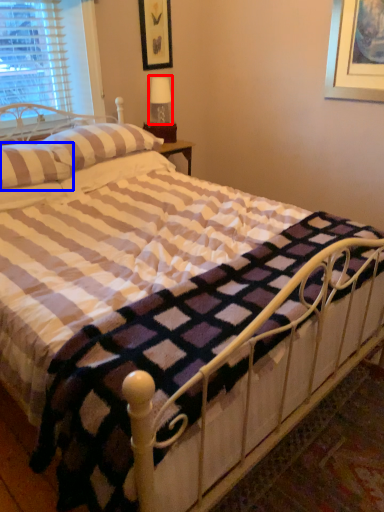
Question: Which object is closer to the camera taking this photo, table lamp (highlighted by a red box) or pillow (highlighted by a blue box)?

Choices:
 (A) table lamp
 (B) pillow

Answer: (B)